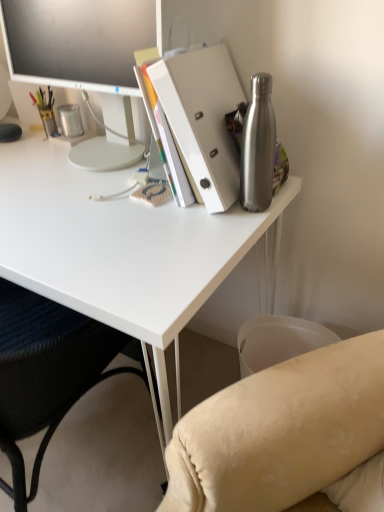
Where is `free space to the left of brushed metal water bottle at right`? This screenshot has height=512, width=384. free space to the left of brushed metal water bottle at right is located at coordinates click(x=175, y=223).